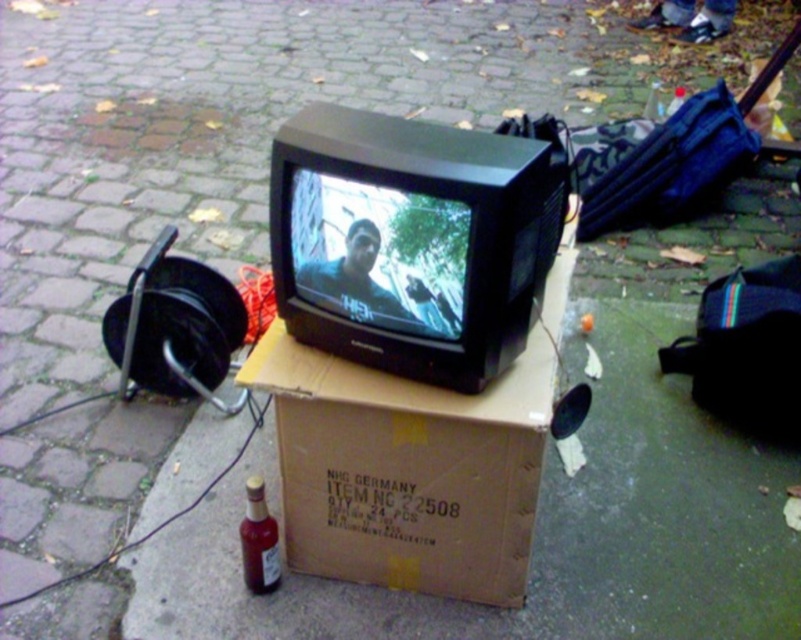
Question: In this image, where is brown cardboard box at center located relative to translucent amber glass bottle at lower left?

Choices:
 (A) below
 (B) above

Answer: (B)

Question: Does brown cardboard box at center have a lesser width compared to translucent amber glass bottle at lower left?

Choices:
 (A) yes
 (B) no

Answer: (B)

Question: Which point is closer to the camera taking this photo?

Choices:
 (A) (349, 362)
 (B) (276, 540)

Answer: (A)

Question: Which object appears closest to the camera in this image?

Choices:
 (A) translucent amber glass bottle at lower left
 (B) brown cardboard box at center

Answer: (B)

Question: Does brown cardboard box at center appear under translucent amber glass bottle at lower left?

Choices:
 (A) yes
 (B) no

Answer: (B)

Question: Which of the following is the closest to the observer?

Choices:
 (A) translucent amber glass bottle at lower left
 (B) brown cardboard box at center

Answer: (B)